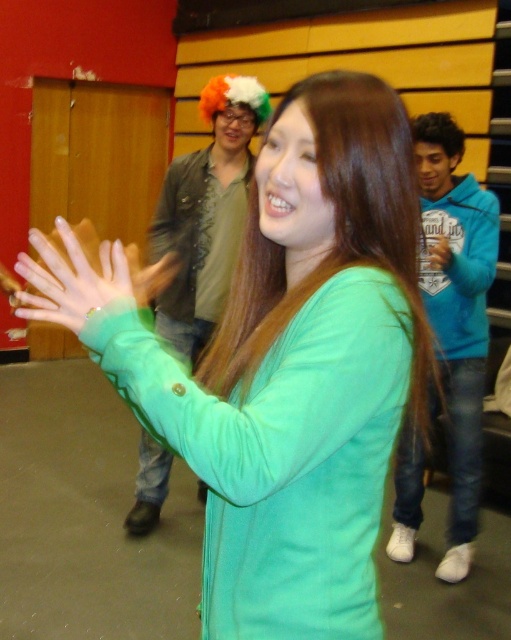
Who is higher up, translucent plastic glove at center or green matte hand at center?

green matte hand at center

Who is positioned more to the right, translucent plastic glove at center or green matte hand at center?

From the viewer's perspective, green matte hand at center appears more on the right side.

Is point (74, 317) closer to viewer compared to point (433, 262)?

Yes, it is.

Identify the location of translucent plastic glove at center. (71, 280).

Is teal smooth hair at center positioned in front of shiny brown jacket at upper center?

Yes.

Which is behind, point (241, 378) or point (233, 241)?

Point (233, 241)

Locate an element on the screen. Image resolution: width=511 pixels, height=640 pixels. teal smooth hair at center is located at coordinates (335, 234).

You are a GUI agent. You are given a task and a screenshot of the screen. Output one action in this format:
    pyautogui.click(x=<x>, y=<y>)
    Task: Click on the translucent plastic glove at center
    The image size is (511, 640).
    Given the screenshot: What is the action you would take?
    pyautogui.click(x=71, y=280)

What do you see at coordinates (71, 280) in the screenshot? I see `translucent plastic glove at center` at bounding box center [71, 280].

Locate an element on the screen. The height and width of the screenshot is (640, 511). translucent plastic glove at center is located at coordinates (71, 280).

The image size is (511, 640). I want to click on translucent plastic glove at center, so click(x=71, y=280).